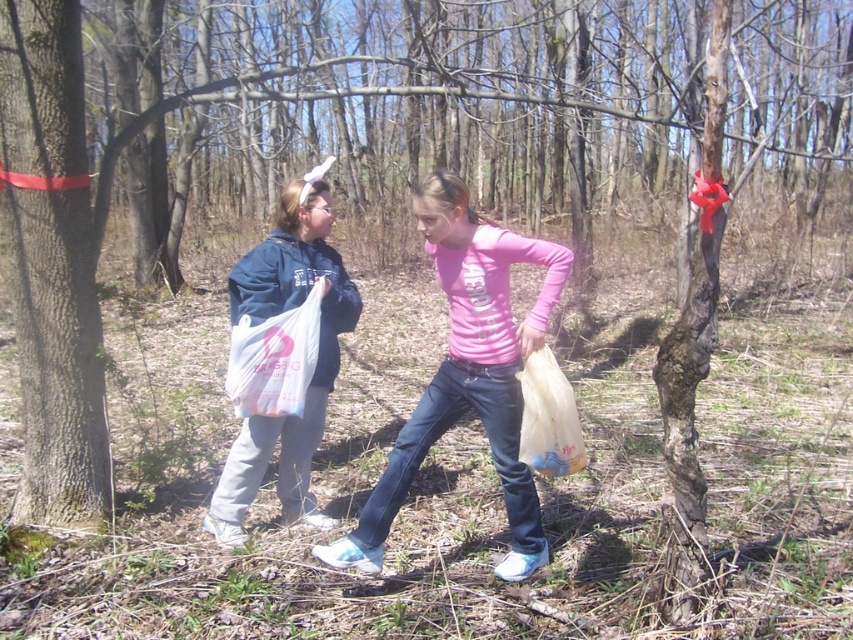
From the picture: Can you confirm if white plastic bag at center is positioned to the left of translucent plastic bag at lower center?

Indeed, white plastic bag at center is positioned on the left side of translucent plastic bag at lower center.

Which of these two, white plastic bag at center or translucent plastic bag at lower center, stands shorter?

translucent plastic bag at lower center is shorter.

Is point (287, 384) less distant than point (524, 380)?

No.

Where is `white plastic bag at center`? This screenshot has width=853, height=640. white plastic bag at center is located at coordinates (274, 358).

Can you confirm if smooth bark tree at left is smaller than pink matte shirt at center?

Indeed, smooth bark tree at left has a smaller size compared to pink matte shirt at center.

Is smooth bark tree at left bigger than pink matte shirt at center?

No.

Between point (9, 225) and point (450, 374), which one is positioned behind?

Point (9, 225)

Locate an element on the screen. The image size is (853, 640). smooth bark tree at left is located at coordinates (51, 266).

Find the location of a particular element. matte blue hoodie at center is located at coordinates (306, 378).

Does point (322, 364) lie behind point (315, 362)?

Yes.

Identify the location of matte blue hoodie at center. The height and width of the screenshot is (640, 853). (306, 378).